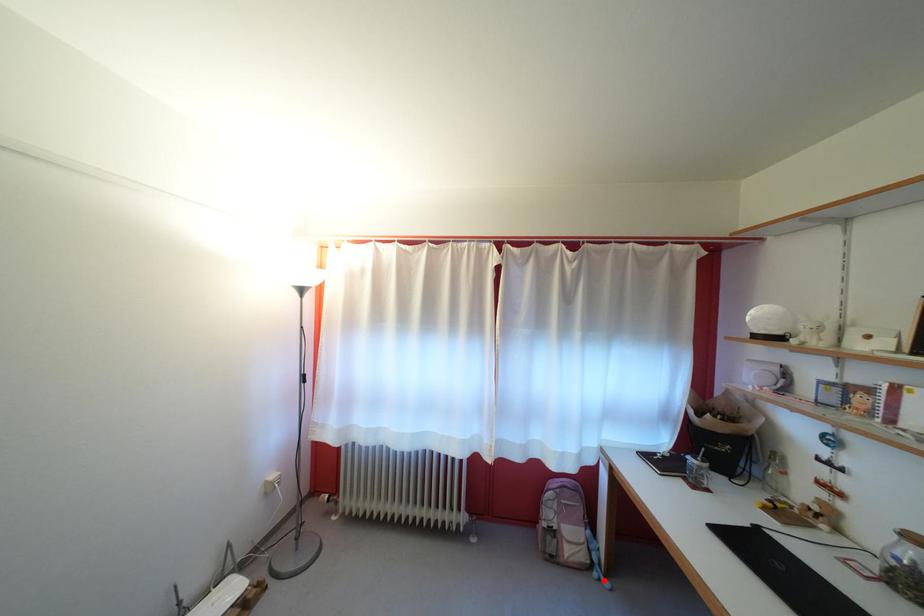
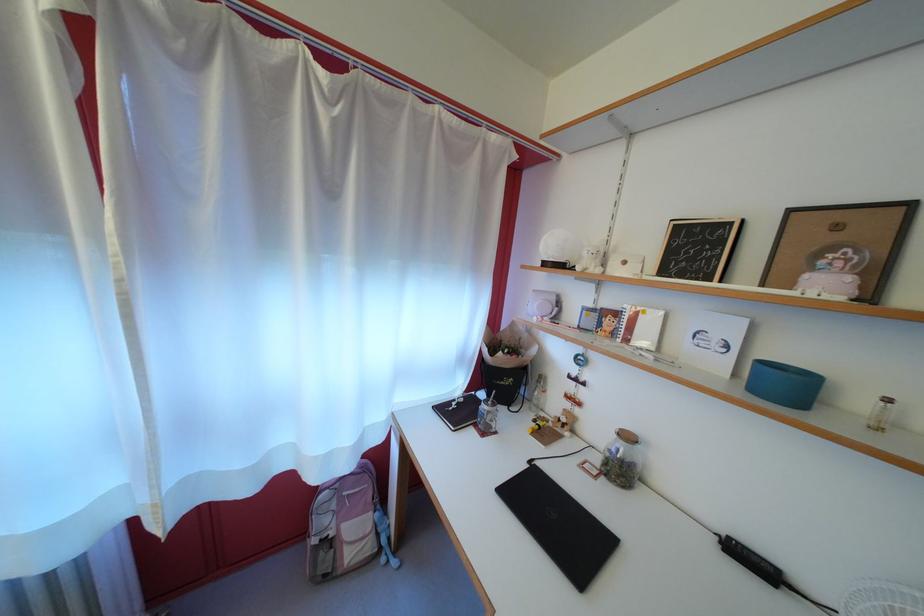
Locate, in the second image, the point that corresponds to the highlighted location in the first image.

(392, 565)